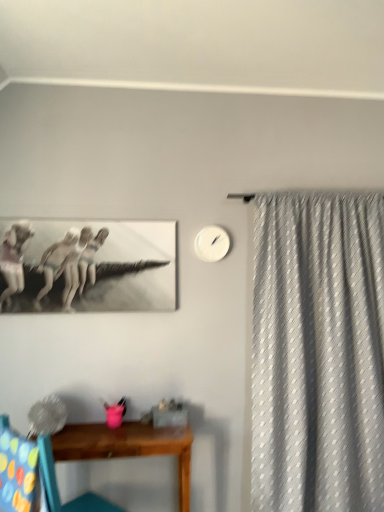
Question: Is white matte clock at upper center further to the viewer compared to wooden chair at lower left?

Choices:
 (A) no
 (B) yes

Answer: (B)

Question: Is white matte clock at upper center shorter than wooden chair at lower left?

Choices:
 (A) no
 (B) yes

Answer: (B)

Question: Can you confirm if white matte clock at upper center is smaller than wooden chair at lower left?

Choices:
 (A) yes
 (B) no

Answer: (A)

Question: Does white matte clock at upper center contain wooden chair at lower left?

Choices:
 (A) no
 (B) yes

Answer: (A)

Question: From a real-world perspective, is white matte clock at upper center physically above wooden chair at lower left?

Choices:
 (A) yes
 (B) no

Answer: (A)

Question: Is the depth of white matte clock at upper center less than that of wooden chair at lower left?

Choices:
 (A) yes
 (B) no

Answer: (B)

Question: Is multicolored fabric swivel chair at lower left positioned before white matte clock at upper center?

Choices:
 (A) yes
 (B) no

Answer: (A)

Question: From the image's perspective, is multicolored fabric swivel chair at lower left located beneath white matte clock at upper center?

Choices:
 (A) no
 (B) yes

Answer: (B)

Question: From the image's perspective, is multicolored fabric swivel chair at lower left over white matte clock at upper center?

Choices:
 (A) no
 (B) yes

Answer: (A)

Question: Considering the relative sizes of multicolored fabric swivel chair at lower left and white matte clock at upper center in the image provided, is multicolored fabric swivel chair at lower left smaller than white matte clock at upper center?

Choices:
 (A) no
 (B) yes

Answer: (A)

Question: Considering the relative sizes of multicolored fabric swivel chair at lower left and white matte clock at upper center in the image provided, is multicolored fabric swivel chair at lower left wider than white matte clock at upper center?

Choices:
 (A) yes
 (B) no

Answer: (A)

Question: Is multicolored fabric swivel chair at lower left to the left of white matte clock at upper center from the viewer's perspective?

Choices:
 (A) no
 (B) yes

Answer: (B)

Question: Considering the relative sizes of wooden chair at lower left and wooden table at lower center in the image provided, is wooden chair at lower left thinner than wooden table at lower center?

Choices:
 (A) no
 (B) yes

Answer: (A)